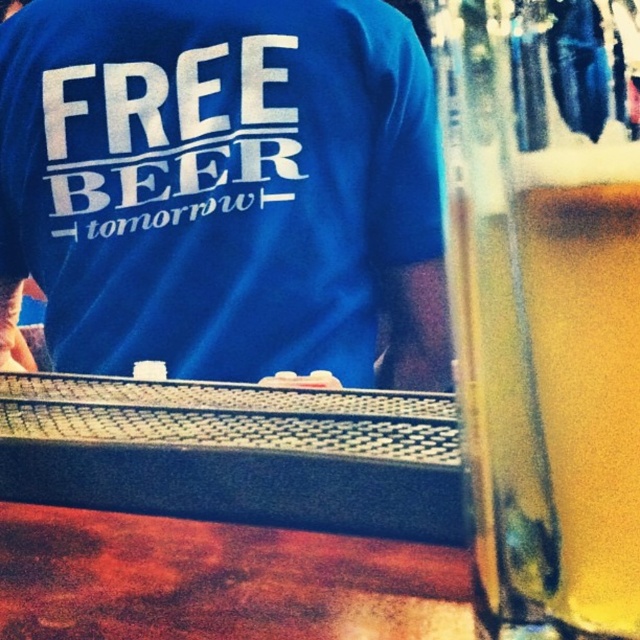
Question: Does blue cotton t-shirt at upper left have a greater width compared to translucent glass beer at right?

Choices:
 (A) yes
 (B) no

Answer: (A)

Question: Can you confirm if blue cotton t-shirt at upper left is smaller than translucent glass beer at right?

Choices:
 (A) no
 (B) yes

Answer: (A)

Question: Can you confirm if blue cotton t-shirt at upper left is positioned to the left of translucent glass beer at right?

Choices:
 (A) yes
 (B) no

Answer: (A)

Question: Which point is closer to the camera?

Choices:
 (A) (621, 99)
 (B) (316, 61)

Answer: (A)